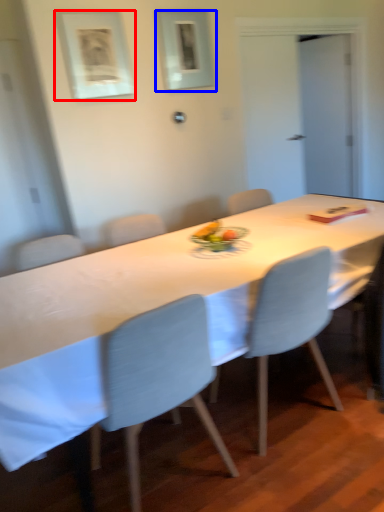
Question: Among these objects, which one is nearest to the camera, picture frame (highlighted by a red box) or picture frame (highlighted by a blue box)?

Choices:
 (A) picture frame
 (B) picture frame

Answer: (A)